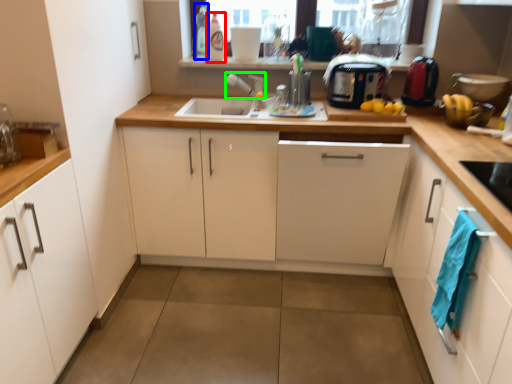
Question: Which is nearer to the bottle (highlighted by a red box)? bottle (highlighted by a blue box) or faucet (highlighted by a green box).

Choices:
 (A) bottle
 (B) faucet

Answer: (A)